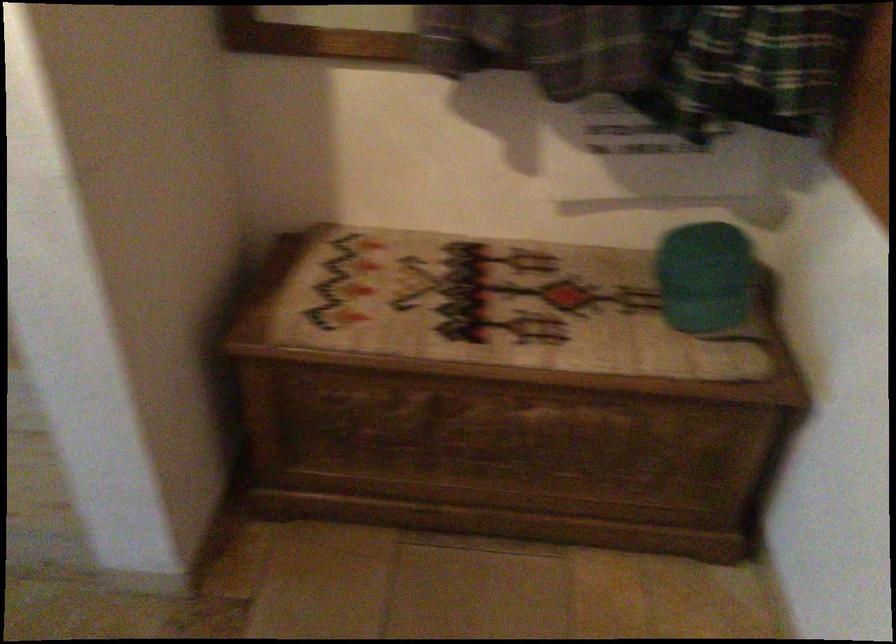
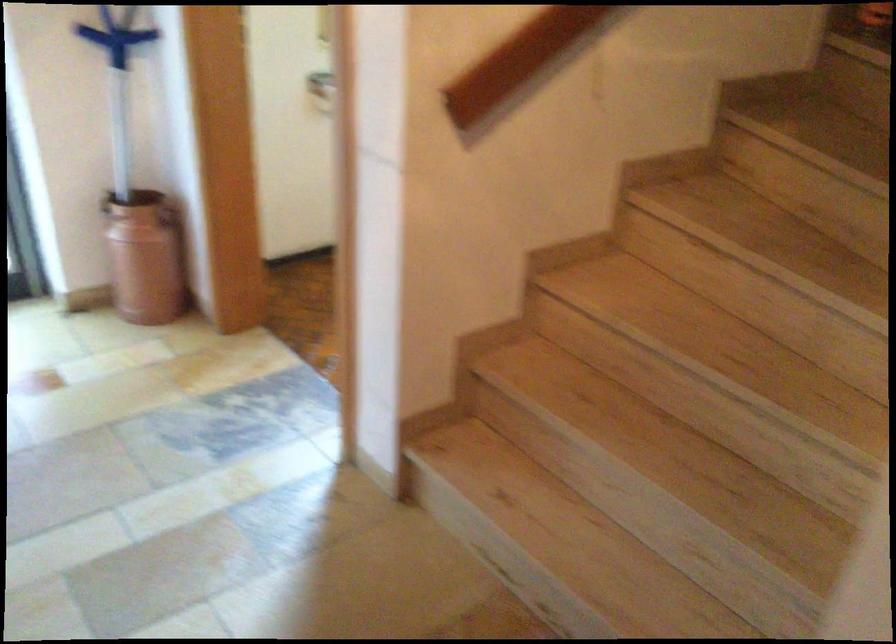
Question: The camera is either moving clockwise (left) or counter-clockwise (right) around the object. The first image is from the beginning of the video and the second image is from the end. Is the camera moving left or right when shooting the video?

Choices:
 (A) Left
 (B) Right

Answer: (B)